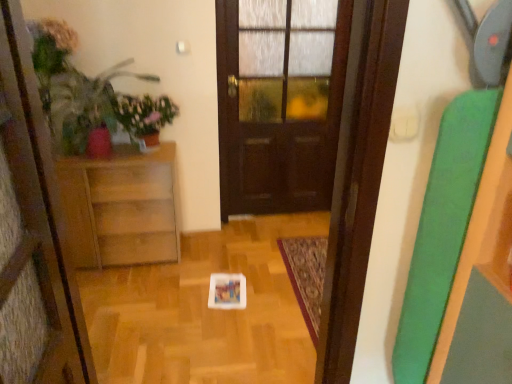
Locate an element on the screen. free point above dark wood door at center (from a real-world perspective) is located at coordinates (288, 0).